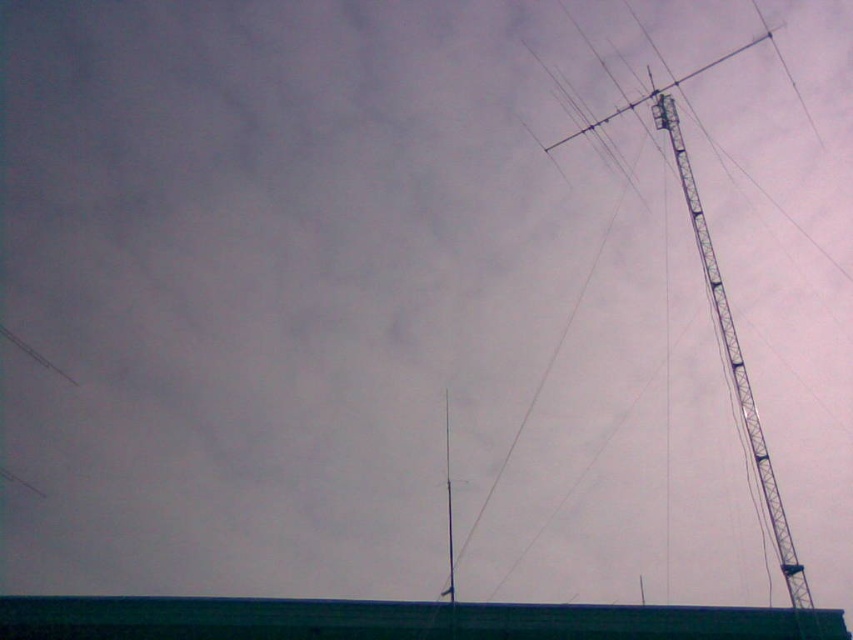
Question: Which object is closer to the camera taking this photo?

Choices:
 (A) metallic pole at center
 (B) metallic tower at right

Answer: (A)

Question: Which object appears closest to the camera in this image?

Choices:
 (A) metallic tower at right
 (B) metallic pole at center

Answer: (B)

Question: Is metallic tower at right positioned at the back of metallic pole at center?

Choices:
 (A) no
 (B) yes

Answer: (B)

Question: Is metallic tower at right wider than metallic pole at center?

Choices:
 (A) no
 (B) yes

Answer: (B)

Question: Does metallic tower at right appear over metallic pole at center?

Choices:
 (A) yes
 (B) no

Answer: (A)